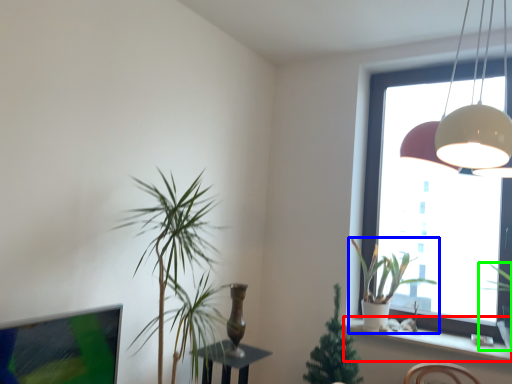
Question: Which object is positioned closest to window sill (highlighted by a red box)? Select from houseplant (highlighted by a blue box) and houseplant (highlighted by a green box).

Choices:
 (A) houseplant
 (B) houseplant

Answer: (A)